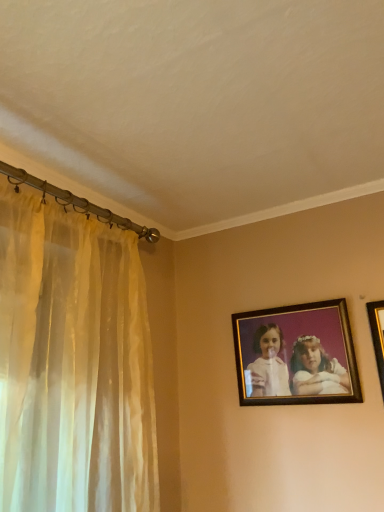
Question: Can gold-framed picture at upper right, the 2th picture frame from the left, be found inside wooden frame at upper right, the 2th picture frame viewed from the right?

Choices:
 (A) no
 (B) yes

Answer: (A)

Question: Can you confirm if wooden frame at upper right, the 2th picture frame viewed from the right, is shorter than gold-framed picture at upper right, positioned as the 2th picture frame in back-to-front order?

Choices:
 (A) no
 (B) yes

Answer: (B)

Question: From a real-world perspective, is wooden frame at upper right, the 1th picture frame positioned from the back, positioned under gold-framed picture at upper right, the 1th picture frame when ordered from front to back, based on gravity?

Choices:
 (A) no
 (B) yes

Answer: (A)

Question: Considering the relative sizes of wooden frame at upper right, the 1th picture frame viewed from the left, and gold-framed picture at upper right, the 1th picture frame when ordered from front to back, in the image provided, is wooden frame at upper right, the 1th picture frame viewed from the left, smaller than gold-framed picture at upper right, the 1th picture frame when ordered from front to back,?

Choices:
 (A) yes
 (B) no

Answer: (B)

Question: Can you confirm if wooden frame at upper right, the 2th picture frame viewed from the right, is taller than gold-framed picture at upper right, positioned as the 2th picture frame in back-to-front order?

Choices:
 (A) yes
 (B) no

Answer: (B)

Question: Is wooden frame at upper right, the 2th picture frame viewed from the right, next to gold-framed picture at upper right, which is counted as the first picture frame, starting from the right, and touching it?

Choices:
 (A) yes
 (B) no

Answer: (B)

Question: Is gold-framed picture at upper right, positioned as the 2th picture frame in back-to-front order, positioned beyond the bounds of wooden frame at upper right, the 2th picture frame viewed from the right?

Choices:
 (A) yes
 (B) no

Answer: (A)

Question: Is the depth of gold-framed picture at upper right, the 2th picture frame from the left, greater than that of wooden frame at upper right, the 1th picture frame viewed from the left?

Choices:
 (A) no
 (B) yes

Answer: (A)

Question: Is gold-framed picture at upper right, the 1th picture frame when ordered from front to back, thinner than wooden frame at upper right, the 2th picture frame viewed from the right?

Choices:
 (A) yes
 (B) no

Answer: (A)

Question: Considering the relative positions of gold-framed picture at upper right, the 1th picture frame when ordered from front to back, and wooden frame at upper right, the 1th picture frame viewed from the left, in the image provided, is gold-framed picture at upper right, the 1th picture frame when ordered from front to back, to the left of wooden frame at upper right, the 1th picture frame viewed from the left, from the viewer's perspective?

Choices:
 (A) yes
 (B) no

Answer: (B)

Question: Considering the relative sizes of gold-framed picture at upper right, which is counted as the first picture frame, starting from the right, and wooden frame at upper right, which is counted as the second picture frame, starting from the front, in the image provided, is gold-framed picture at upper right, which is counted as the first picture frame, starting from the right, bigger than wooden frame at upper right, which is counted as the second picture frame, starting from the front,?

Choices:
 (A) no
 (B) yes

Answer: (A)

Question: Is gold-framed picture at upper right, the 2th picture frame from the left, to the right of wooden frame at upper right, the 2th picture frame viewed from the right, from the viewer's perspective?

Choices:
 (A) no
 (B) yes

Answer: (B)

Question: Choose the correct answer: Is wooden frame at upper right, which is counted as the second picture frame, starting from the front, inside gold-framed picture at upper right, positioned as the 2th picture frame in back-to-front order, or outside it?

Choices:
 (A) outside
 (B) inside

Answer: (A)